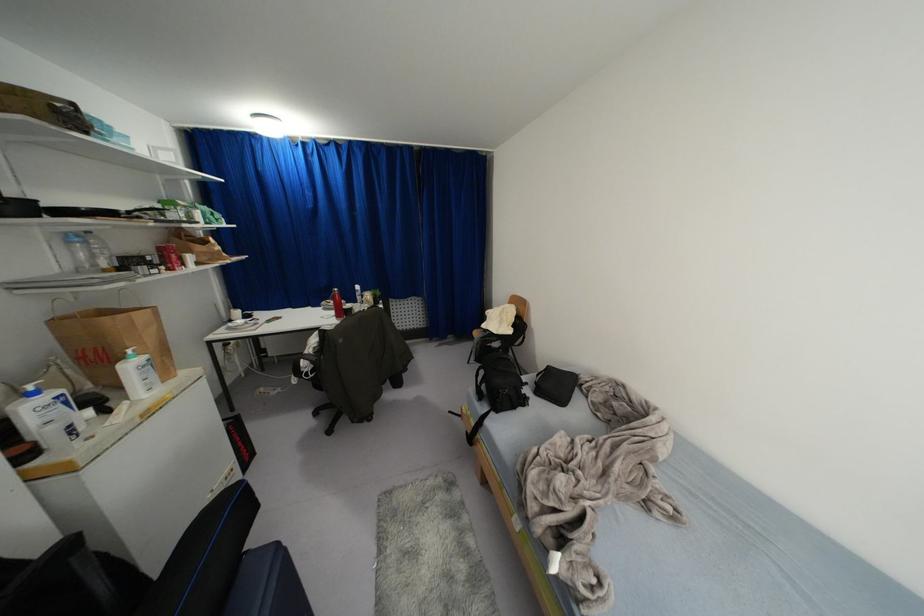
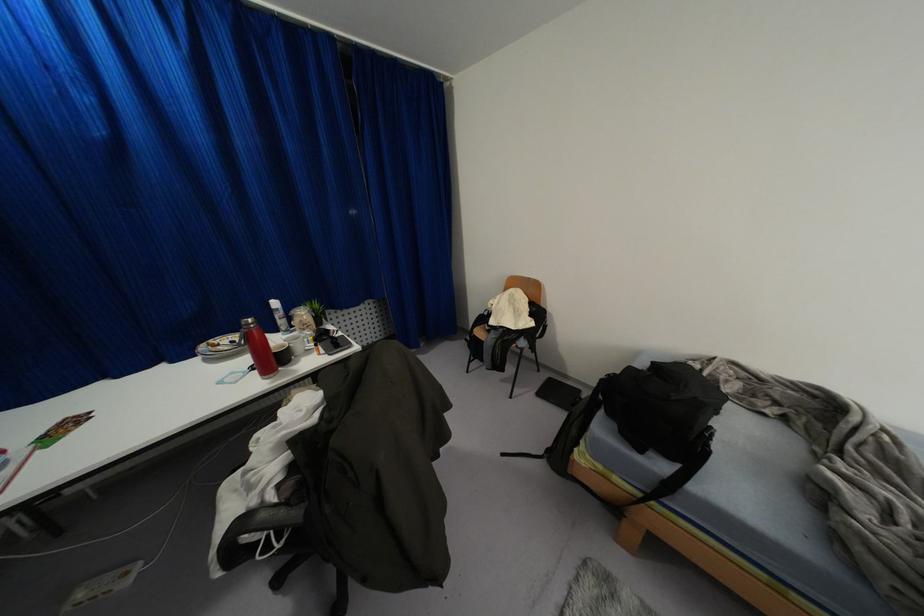
In a continuous first-person perspective shot, in which direction is the camera moving?

The movement direction of the cameraman is left, forward.